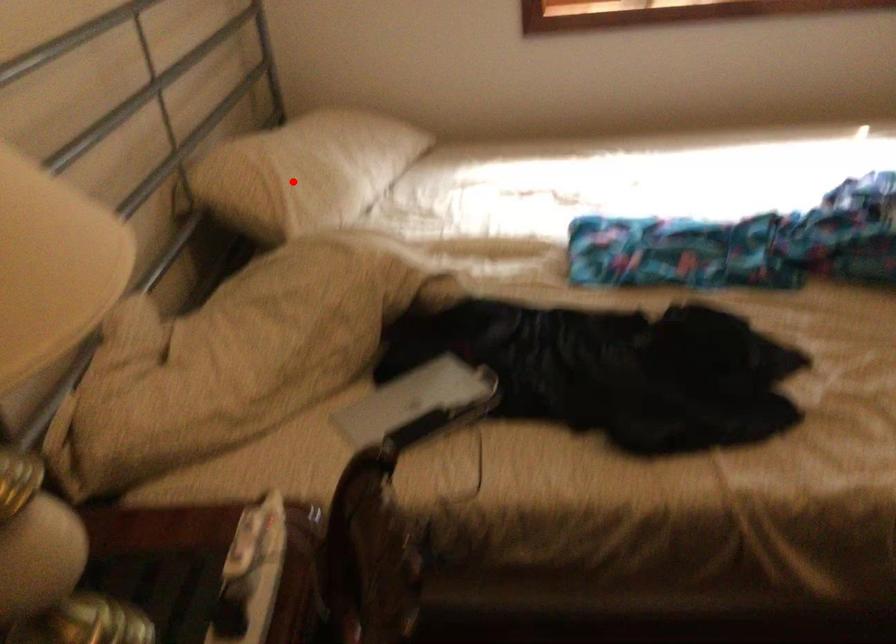
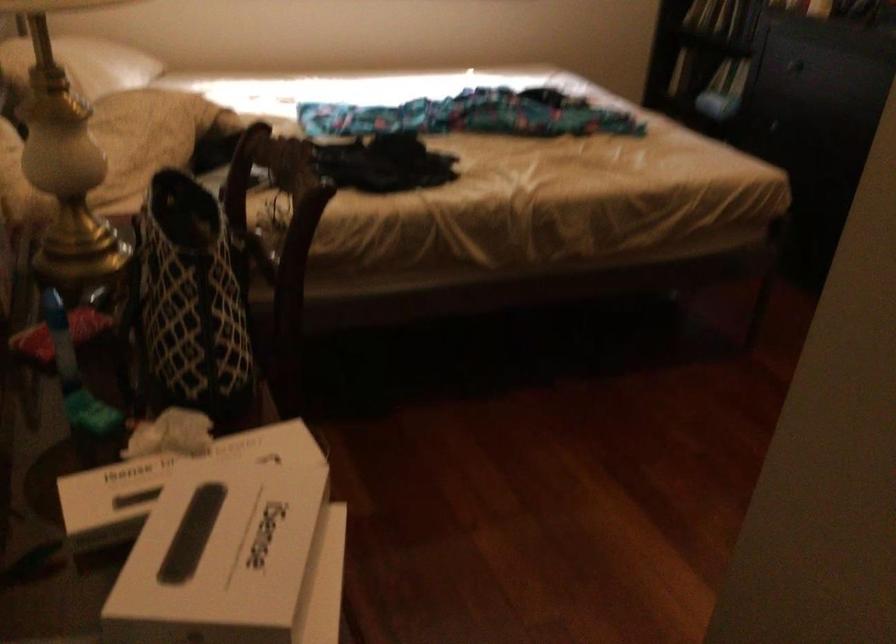
Question: I am providing you with two images of the same scene from different viewpoints. Given a red point in image1, look at the same physical point in image2. Is it:

Choices:
 (A) Closer to the viewpoint
 (B) Farther from the viewpoint

Answer: (B)